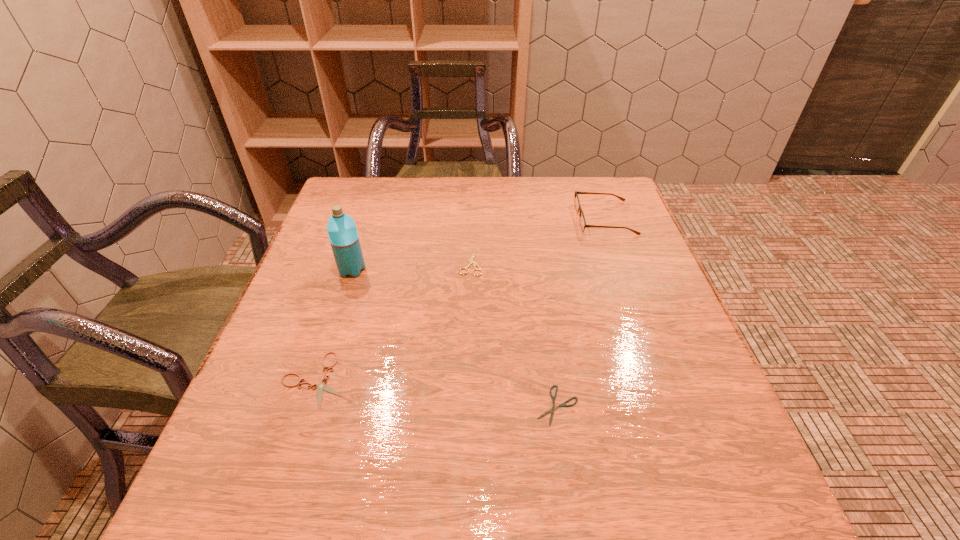
Find the location of a particular element. The height and width of the screenshot is (540, 960). free point that satisfies the following two spatial constraints: 1. on the front-facing side of the fourth shortest object; 2. on the front side of the tallest shears is located at coordinates (621, 262).

Identify the location of free space that satisfies the following two spatial constraints: 1. on the back side of the tallest object; 2. on the right side of the second shortest object. The image size is (960, 540). (350, 270).